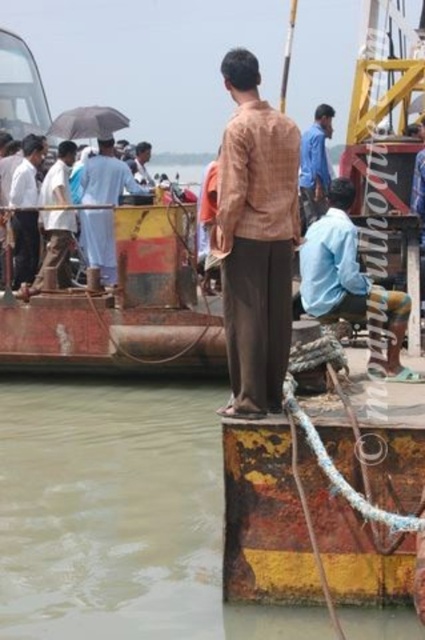
Question: Can you confirm if blue cotton shirt at center is positioned to the left of blue cotton shirt at upper center?

Choices:
 (A) yes
 (B) no

Answer: (B)

Question: Which of the following is the farthest from the observer?

Choices:
 (A) blue cotton shirt at upper center
 (B) brown checkered shirt at center
 (C) light brown fabric shirt at center

Answer: (C)

Question: Considering the relative positions of blue cotton shirt at upper center and light brown fabric shirt at center in the image provided, where is blue cotton shirt at upper center located with respect to light brown fabric shirt at center?

Choices:
 (A) right
 (B) left

Answer: (A)

Question: Is brown murky water at lower left to the left of brown checkered shirt at center from the viewer's perspective?

Choices:
 (A) yes
 (B) no

Answer: (A)

Question: Which object is farther from the camera taking this photo?

Choices:
 (A) blue cotton shirt at upper center
 (B) blue cotton shirt at center

Answer: (B)

Question: Which object is positioned farthest from the blue cotton shirt at center?

Choices:
 (A) light brown fabric shirt at center
 (B) brown checkered shirt at center
 (C) brown murky water at lower left

Answer: (A)